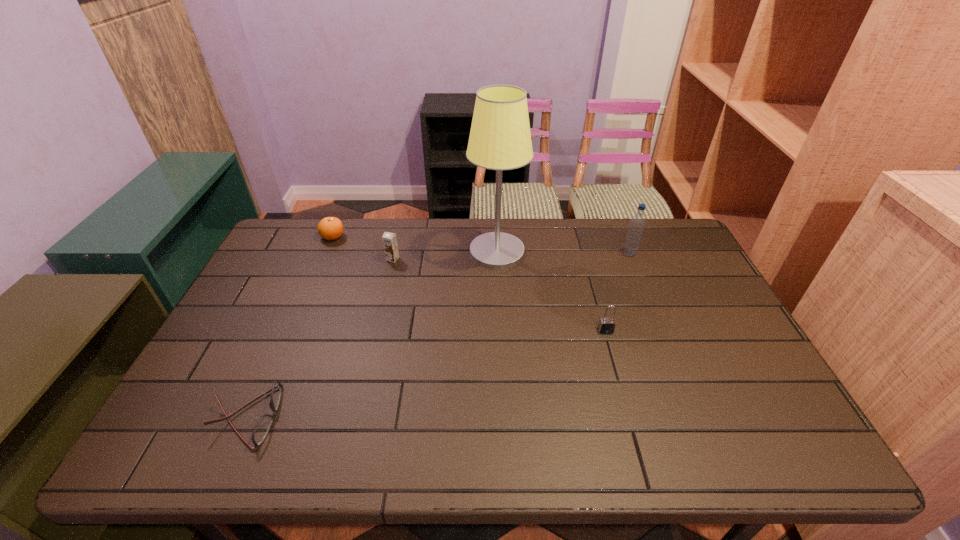
This screenshot has height=540, width=960. I want to click on object that is at the near edge, so click(x=261, y=430).

Where is `clementine at the left edge`? Image resolution: width=960 pixels, height=540 pixels. clementine at the left edge is located at coordinates (329, 228).

Find the location of `spectacles located in the left edge section of the desktop`. spectacles located in the left edge section of the desktop is located at coordinates (261, 430).

Image resolution: width=960 pixels, height=540 pixels. I want to click on object at the far left corner, so click(x=329, y=228).

Where is `object that is at the near left corner`? object that is at the near left corner is located at coordinates (261, 430).

Locate an element on the screen. The width and height of the screenshot is (960, 540). vacant point at the far edge is located at coordinates (461, 237).

Locate an element on the screen. vacant space at the left edge of the desktop is located at coordinates (247, 382).

Locate an element on the screen. The width and height of the screenshot is (960, 540). blank space at the right edge of the desktop is located at coordinates (744, 381).

Identify the location of vacant point at the far left corner. Image resolution: width=960 pixels, height=540 pixels. (291, 225).

This screenshot has height=540, width=960. In order to click on vacant area at the near left corner of the desktop in this screenshot , I will do `click(151, 462)`.